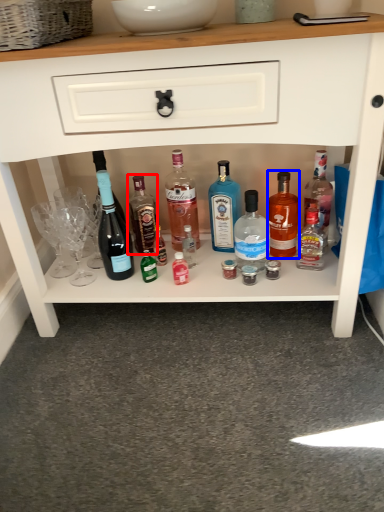
Question: Which point is further to the camera, bottle (highlighted by a red box) or bottle (highlighted by a blue box)?

Choices:
 (A) bottle
 (B) bottle

Answer: (A)